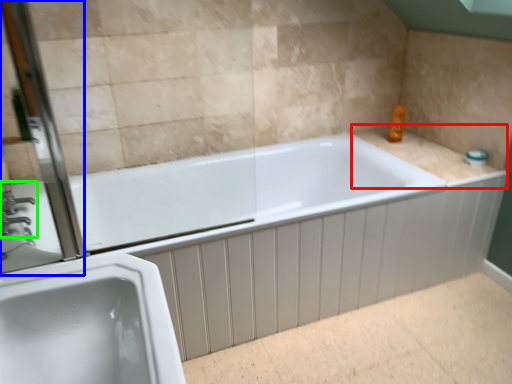
Question: Which object is positioned closest to counter top (highlighted by a red box)? Select from screen door (highlighted by a blue box) and tap (highlighted by a green box).

Choices:
 (A) screen door
 (B) tap

Answer: (A)